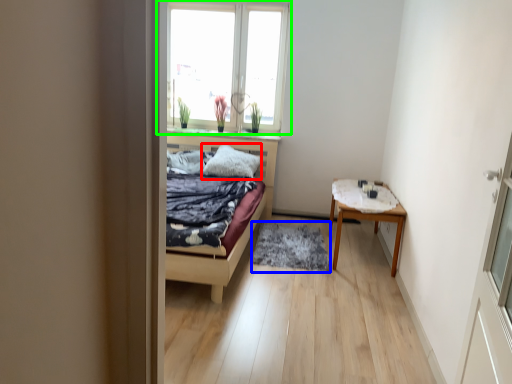
Question: Estimate the real-world distances between objects in this image. Which object is farther from pillow (highlighted by a red box), mat (highlighted by a blue box) or window (highlighted by a green box)?

Choices:
 (A) mat
 (B) window

Answer: (B)